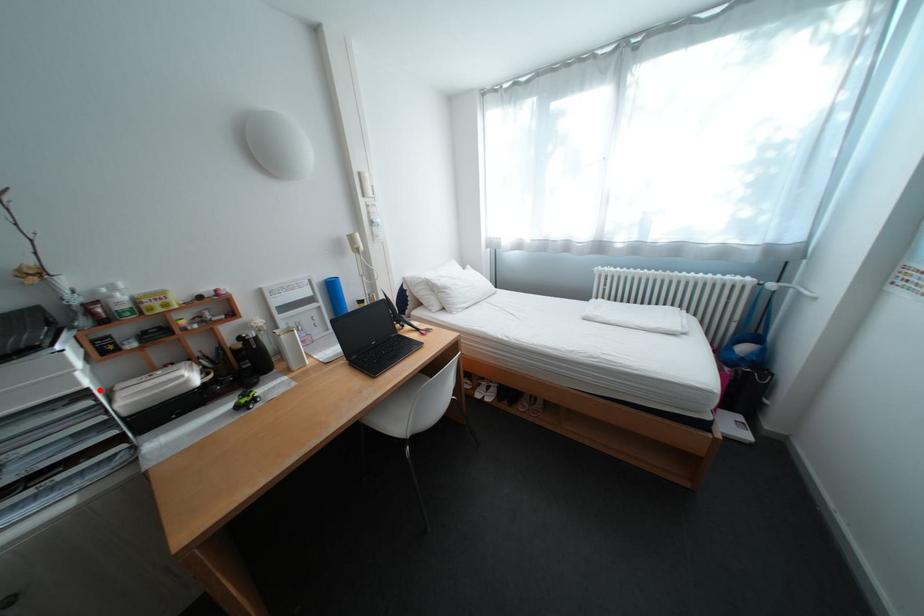
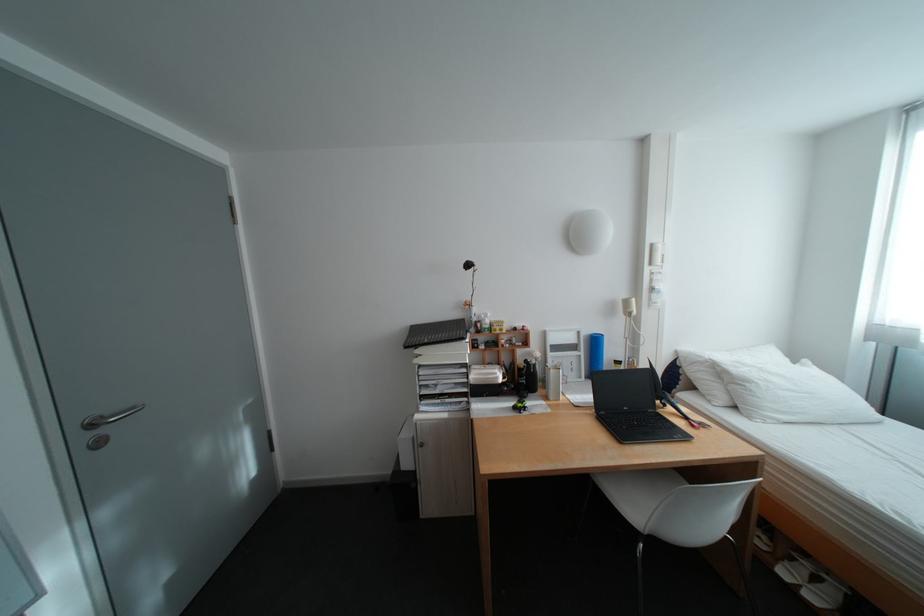
Question: I am providing you with two images of the same scene from different viewpoints. A red point is shown in image1. For the corresponding object point in image2, is it positioned nearer or farther from the camera?

Choices:
 (A) Nearer
 (B) Farther

Answer: (B)